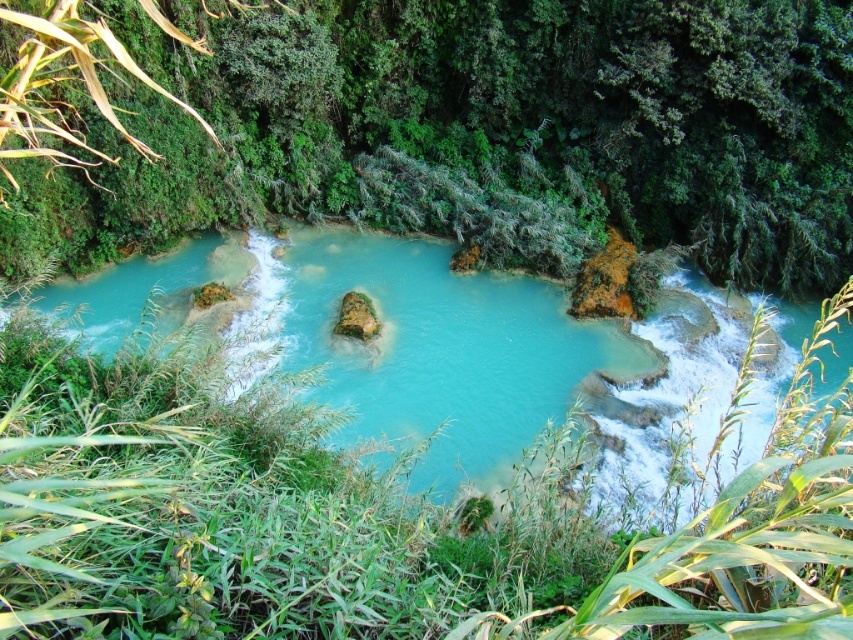
Is green leafy vegetation at center thinner than turquoise glossy water at center?

In fact, green leafy vegetation at center might be wider than turquoise glossy water at center.

Which is above, green leafy vegetation at center or turquoise glossy water at center?

Positioned higher is green leafy vegetation at center.

Which is behind, point (181, 204) or point (263, 324)?

Positioned behind is point (181, 204).

The width and height of the screenshot is (853, 640). Find the location of `green leafy vegetation at center`. green leafy vegetation at center is located at coordinates (451, 129).